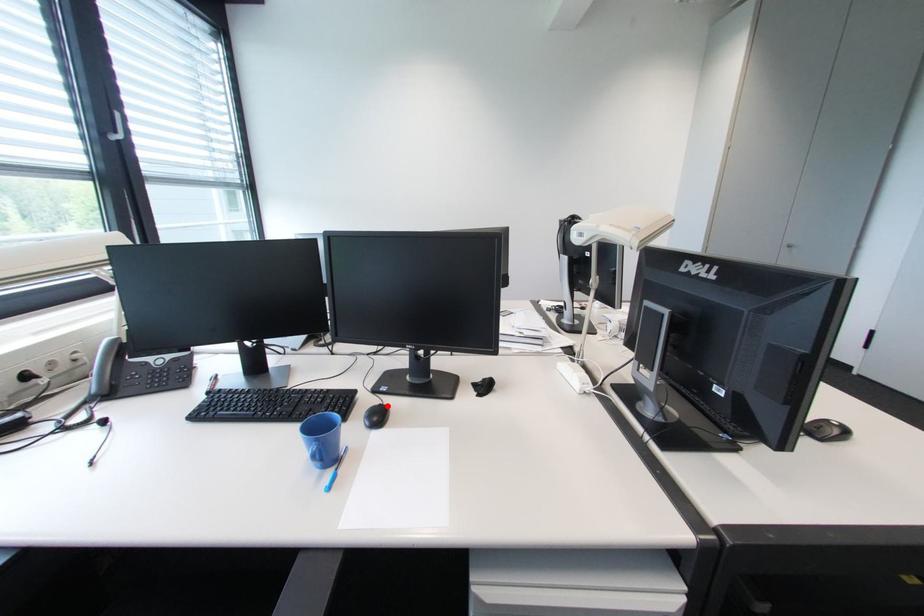
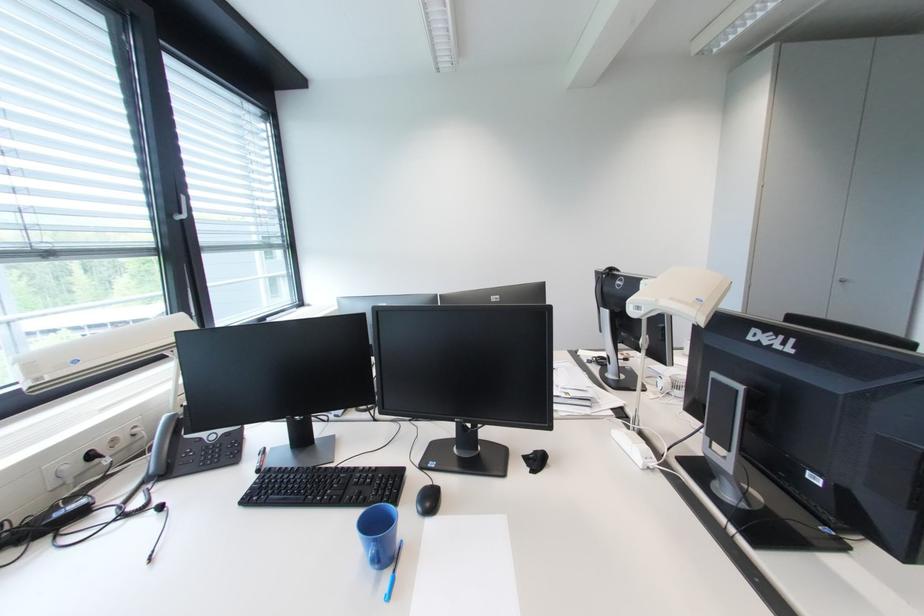
Find the pixel in the second image that matches the highlighted location in the first image.

(438, 485)